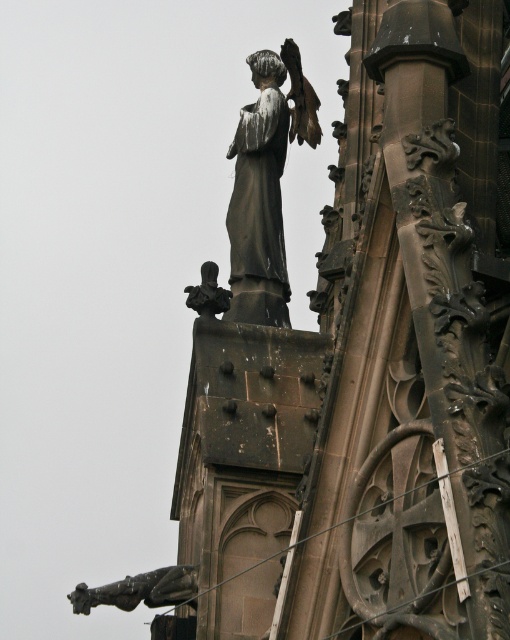
You are an art conservator assessing the placement of the bronze statue at upper center and the polished bronze statue at lower left. Given their heights, which one would require a higher platform to avoid being obscured by nearby architectural elements?

The bronze statue at upper center is taller than the polished bronze statue at lower left, so it would require a higher platform to avoid being obscured by nearby architectural elements.

You are an art conservator examining the Gothic structure. You notice two statues at the upper center. Which one is closer to you, the dark brown stone statue at upper center or the bronze statue at upper center?

The dark brown stone statue at upper center is closer to you because it is positioned in front of the bronze statue at upper center.